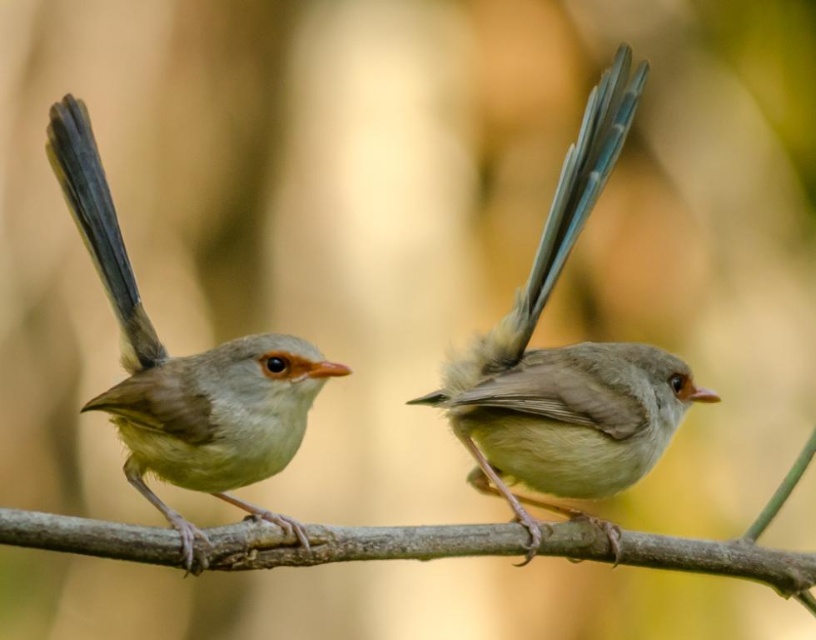
Can you confirm if smooth gray bird at center is wider than smooth brown bird at left?

Yes.

Between point (469, 356) and point (136, 410), which one is positioned in front?

Positioned in front is point (136, 410).

Find the location of `smooth gray bird at center`. smooth gray bird at center is located at coordinates (566, 360).

Locate an element on the screen. This screenshot has width=816, height=640. smooth gray bird at center is located at coordinates (566, 360).

Identify the location of smooth brown bird at left. This screenshot has width=816, height=640. (184, 365).

Which is in front, point (249, 339) or point (360, 538)?

Point (249, 339) is more forward.

Locate an element on the screen. This screenshot has height=640, width=816. smooth brown bird at left is located at coordinates (184, 365).

Between smooth gray bird at center and brown smooth branch at center, which one is positioned lower?

brown smooth branch at center

Who is taller, smooth gray bird at center or brown smooth branch at center?

smooth gray bird at center is taller.

You are a GUI agent. You are given a task and a screenshot of the screen. Output one action in this format:
    pyautogui.click(x=<x>, y=<y>)
    Task: Click on the smooth gray bird at center
    The image size is (816, 640).
    Given the screenshot: What is the action you would take?
    pyautogui.click(x=566, y=360)